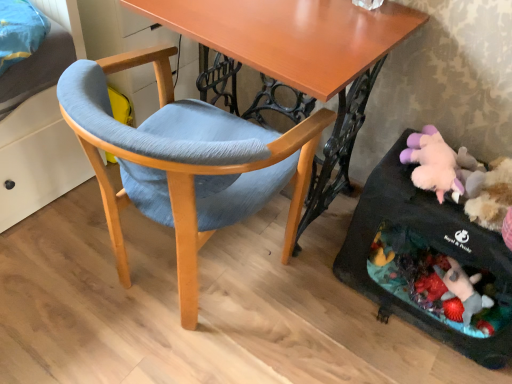
Question: Does wooden desk at center have a greater height compared to matte blue fabric chair at center?

Choices:
 (A) no
 (B) yes

Answer: (B)

Question: From the image's perspective, is wooden desk at center beneath matte blue fabric chair at center?

Choices:
 (A) no
 (B) yes

Answer: (A)

Question: Is wooden desk at center positioned in front of matte blue fabric chair at center?

Choices:
 (A) no
 (B) yes

Answer: (A)

Question: Is wooden desk at center not inside matte blue fabric chair at center?

Choices:
 (A) no
 (B) yes

Answer: (A)

Question: Can you confirm if wooden desk at center is positioned to the right of matte blue fabric chair at center?

Choices:
 (A) yes
 (B) no

Answer: (A)

Question: Is point (73, 102) closer or farther from the camera than point (351, 264)?

Choices:
 (A) closer
 (B) farther

Answer: (A)

Question: From the image's perspective, is matte blue fabric chair at center above or below black fabric baby carriage at lower right?

Choices:
 (A) below
 (B) above

Answer: (B)

Question: Would you say matte blue fabric chair at center is to the left or to the right of black fabric baby carriage at lower right in the picture?

Choices:
 (A) left
 (B) right

Answer: (A)

Question: Do you think matte blue fabric chair at center is within black fabric baby carriage at lower right, or outside of it?

Choices:
 (A) outside
 (B) inside

Answer: (A)

Question: In terms of size, does wooden desk at center appear bigger or smaller than matte blue fabric chair at center?

Choices:
 (A) small
 (B) big

Answer: (B)

Question: From a real-world perspective, is wooden desk at center positioned above or below matte blue fabric chair at center?

Choices:
 (A) above
 (B) below

Answer: (A)

Question: Is point (301, 223) positioned closer to the camera than point (279, 140)?

Choices:
 (A) farther
 (B) closer

Answer: (A)

Question: Based on their positions, is wooden desk at center located to the left or right of matte blue fabric chair at center?

Choices:
 (A) left
 (B) right

Answer: (B)

Question: Is black fabric baby carriage at lower right taller or shorter than wooden desk at center?

Choices:
 (A) tall
 (B) short

Answer: (B)

Question: Which is correct: black fabric baby carriage at lower right is inside wooden desk at center, or outside of it?

Choices:
 (A) inside
 (B) outside

Answer: (B)